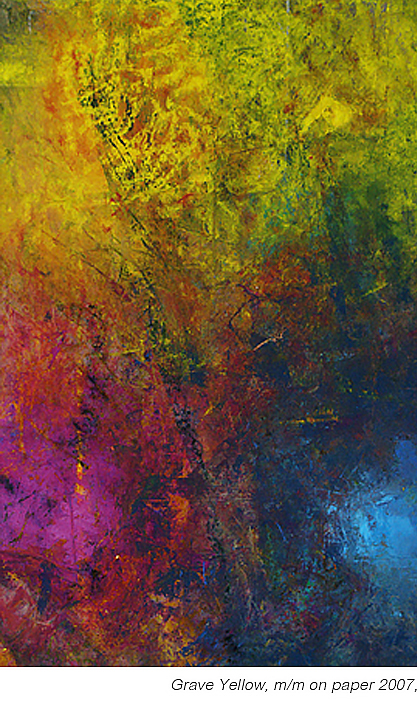
Where is `portrait/painting`? portrait/painting is located at coordinates (408, 11).